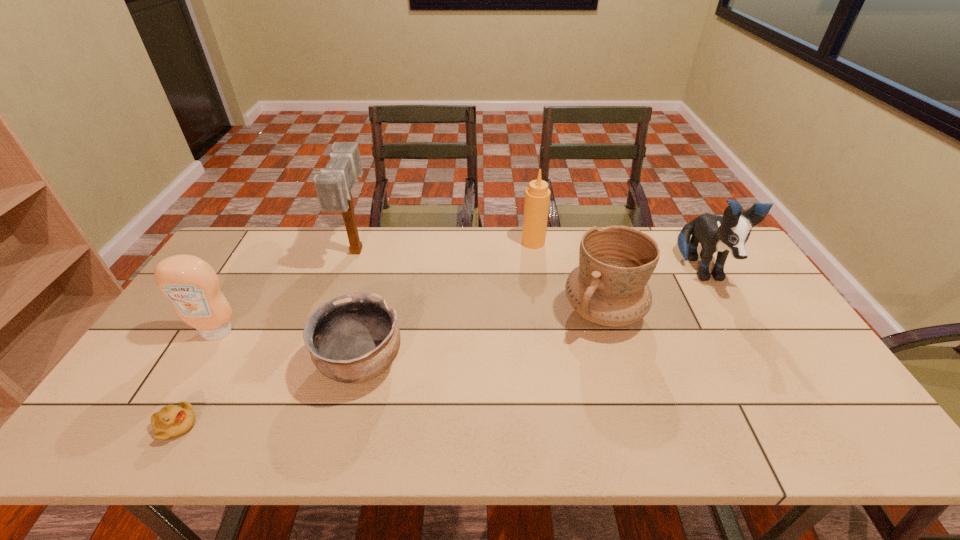
The image size is (960, 540). In order to click on condiment that is at the far edge in this screenshot , I will do `click(537, 196)`.

The image size is (960, 540). What are the coordinates of `object situated at the near edge` in the screenshot? It's located at (171, 421).

Find the location of a particular element. condiment positioned at the left edge is located at coordinates (190, 283).

Locate an element on the screen. The height and width of the screenshot is (540, 960). duckling located at the left edge is located at coordinates (171, 421).

At what (x,y) coordinates should I click in order to perform the action: click on object that is at the right edge. Please return your answer as a coordinate pair (x, y). Looking at the image, I should click on (729, 233).

The height and width of the screenshot is (540, 960). Find the location of `object that is positioned at the near left corner`. object that is positioned at the near left corner is located at coordinates (171, 421).

I want to click on object at the far right corner, so click(x=729, y=233).

The height and width of the screenshot is (540, 960). Find the location of `vacant space at the far edge of the desktop`. vacant space at the far edge of the desktop is located at coordinates (417, 229).

Locate an element on the screen. Image resolution: width=960 pixels, height=540 pixels. vacant space at the near edge is located at coordinates (281, 426).

You are a GUI agent. You are given a task and a screenshot of the screen. Output one action in this format:
    pyautogui.click(x=<x>, y=<y>)
    Task: Click on the vacant space at the left edge of the desktop
    This screenshot has height=540, width=960.
    Given the screenshot: What is the action you would take?
    pyautogui.click(x=194, y=354)